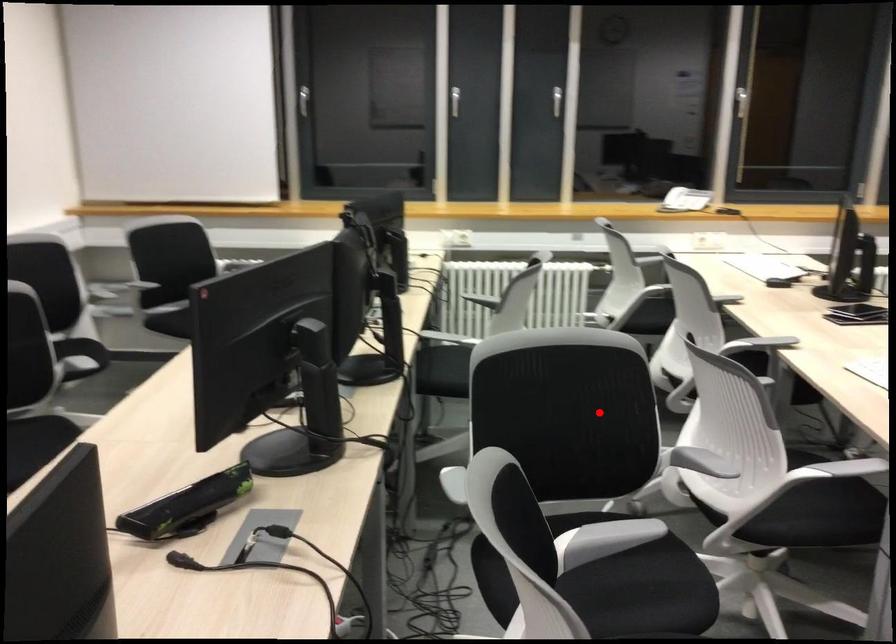
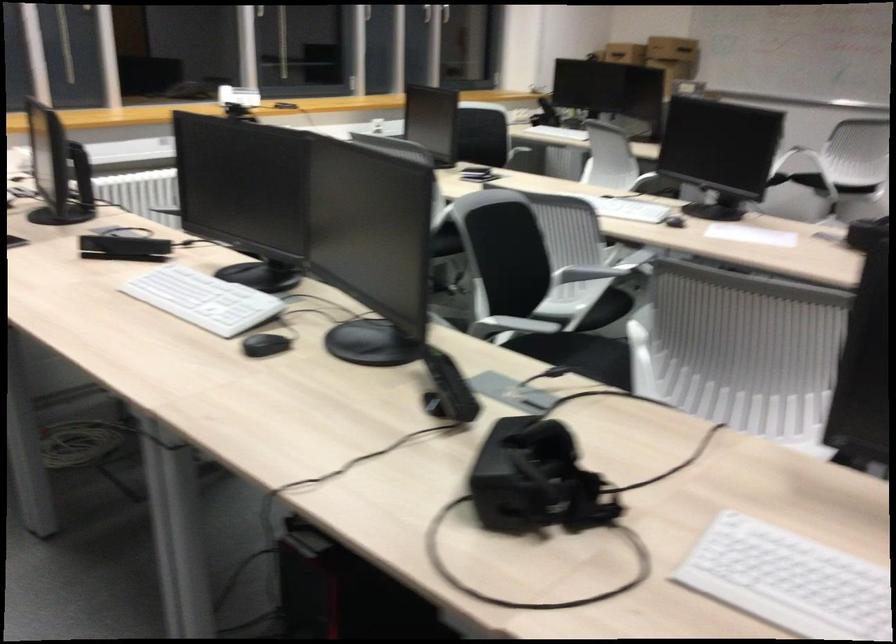
Question: A red point is marked in image1. In image2, is the corresponding 3D point closer to the camera or farther? Reply with the corresponding letter.

Choices:
 (A) The corresponding 3D point is closer.
 (B) The corresponding 3D point is farther.

Answer: (B)